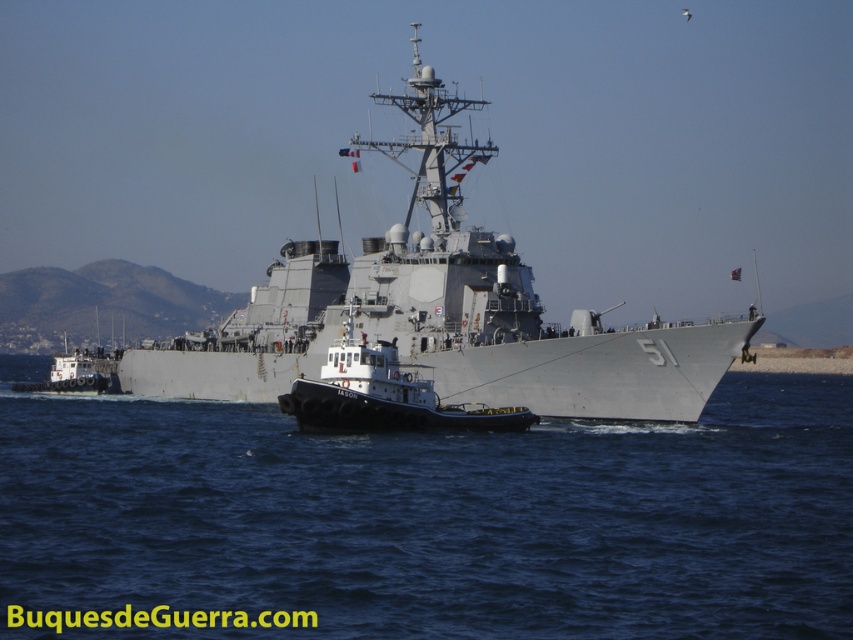
You are standing on the deck of the destroyer and want to reach the point marked at coordinates (297, 480). If your walking speed is 3 feet per second, how long will it take you to reach that point?

The point marked at coordinates (297, 480) is 290.13 feet away from you. At a walking speed of 3 feet per second, it would take approximately 96.71 seconds to reach the point.

You are a crane operator trying to lift a heavy container from the gray metallic warship at center to the black rubber tugboat at center. Which vessel should you lower the container to first based on their heights?

The gray metallic warship at center is taller than the black rubber tugboat at center, so you should lower the container to the black rubber tugboat at center first because it is shorter and safer to place the container there before transferring it to the taller warship.